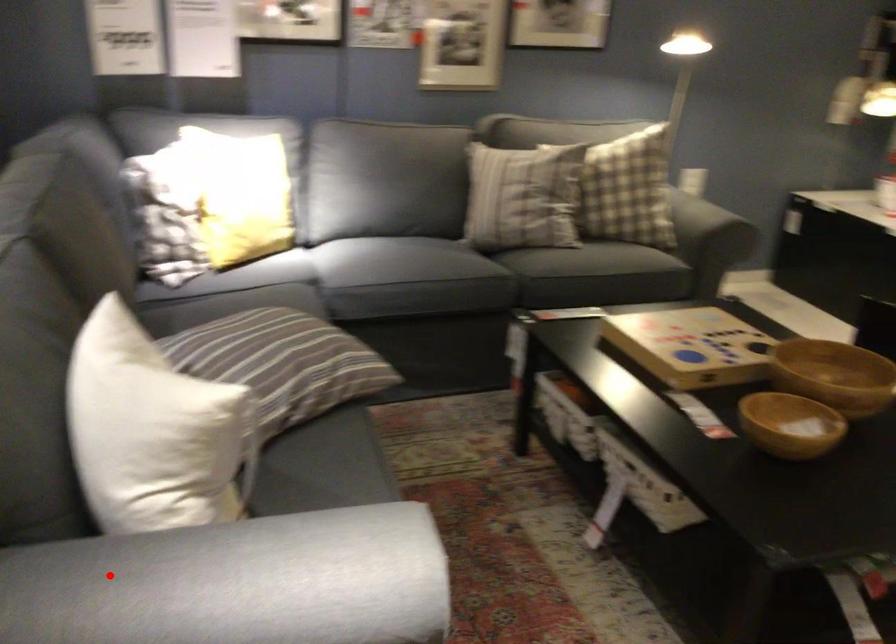
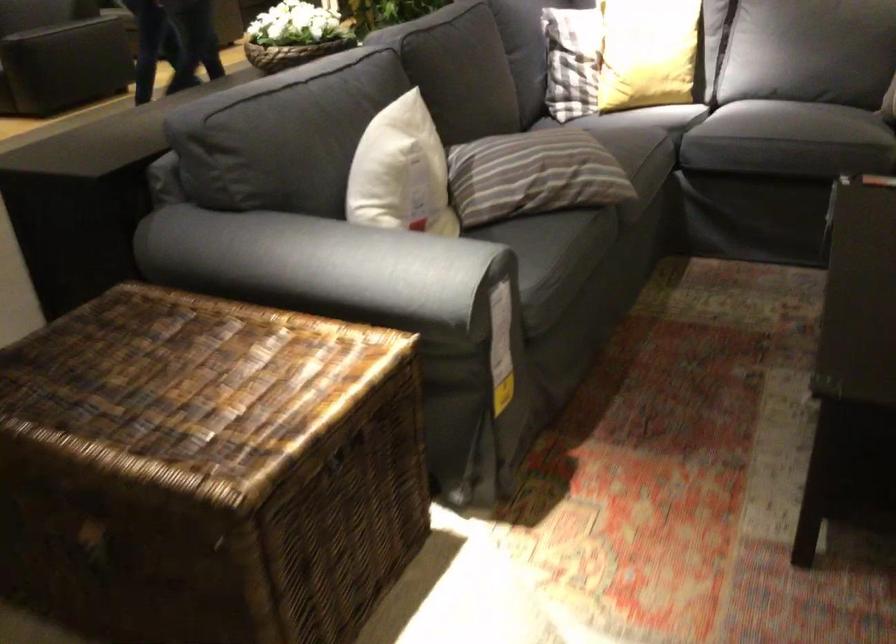
Question: I am providing you with two images of the same scene from different viewpoints. Image1 has a red point marked. In image2, the corresponding 3D location appears at what relative position? Reply with the corresponding letter.

Choices:
 (A) Closer
 (B) Farther

Answer: (B)